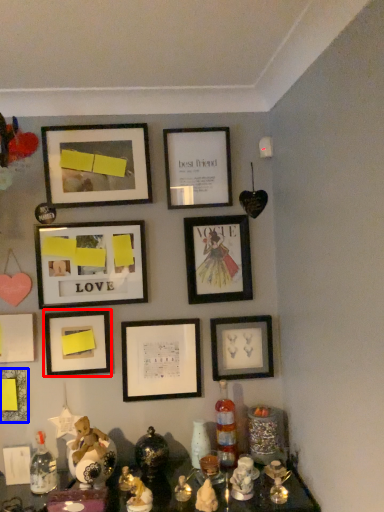
Question: Which point is further to the camera, picture frame (highlighted by a red box) or picture frame (highlighted by a blue box)?

Choices:
 (A) picture frame
 (B) picture frame

Answer: (A)